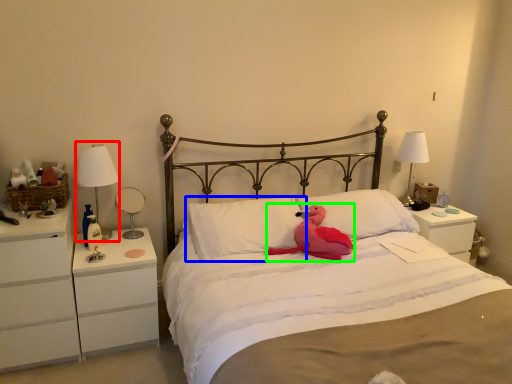
Question: Which object is positioned farthest from bedside lamp (highlighted by a red box)? Select from pillow (highlighted by a blue box) and animal (highlighted by a green box).

Choices:
 (A) pillow
 (B) animal

Answer: (B)